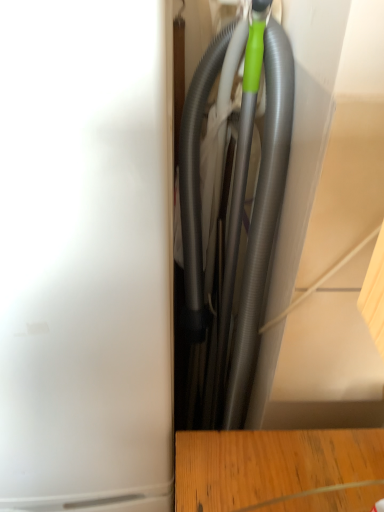
Question: Does gray rubber garden hose at center have a smaller size compared to matte gray vacuum cleaner at center?

Choices:
 (A) yes
 (B) no

Answer: (A)

Question: Does gray rubber garden hose at center appear on the left side of matte gray vacuum cleaner at center?

Choices:
 (A) no
 (B) yes

Answer: (A)

Question: Is gray rubber garden hose at center far from matte gray vacuum cleaner at center?

Choices:
 (A) no
 (B) yes

Answer: (A)

Question: From the image's perspective, is gray rubber garden hose at center located above matte gray vacuum cleaner at center?

Choices:
 (A) no
 (B) yes

Answer: (B)

Question: Is gray rubber garden hose at center wider than matte gray vacuum cleaner at center?

Choices:
 (A) yes
 (B) no

Answer: (B)

Question: Can we say gray rubber garden hose at center lies outside matte gray vacuum cleaner at center?

Choices:
 (A) no
 (B) yes

Answer: (B)

Question: Does matte gray vacuum cleaner at center appear on the right side of gray rubber garden hose at center?

Choices:
 (A) no
 (B) yes

Answer: (A)

Question: Is gray rubber garden hose at center a part of matte gray vacuum cleaner at center?

Choices:
 (A) yes
 (B) no

Answer: (B)

Question: Considering the relative positions of matte gray vacuum cleaner at center and gray rubber garden hose at center in the image provided, is matte gray vacuum cleaner at center in front of gray rubber garden hose at center?

Choices:
 (A) no
 (B) yes

Answer: (B)

Question: Can you confirm if matte gray vacuum cleaner at center is wider than gray rubber garden hose at center?

Choices:
 (A) yes
 (B) no

Answer: (A)

Question: From a real-world perspective, is matte gray vacuum cleaner at center located beneath gray rubber garden hose at center?

Choices:
 (A) yes
 (B) no

Answer: (A)

Question: Is matte gray vacuum cleaner at center touching gray rubber garden hose at center?

Choices:
 (A) no
 (B) yes

Answer: (A)

Question: Is matte gray vacuum cleaner at center taller or shorter than gray rubber garden hose at center?

Choices:
 (A) tall
 (B) short

Answer: (A)